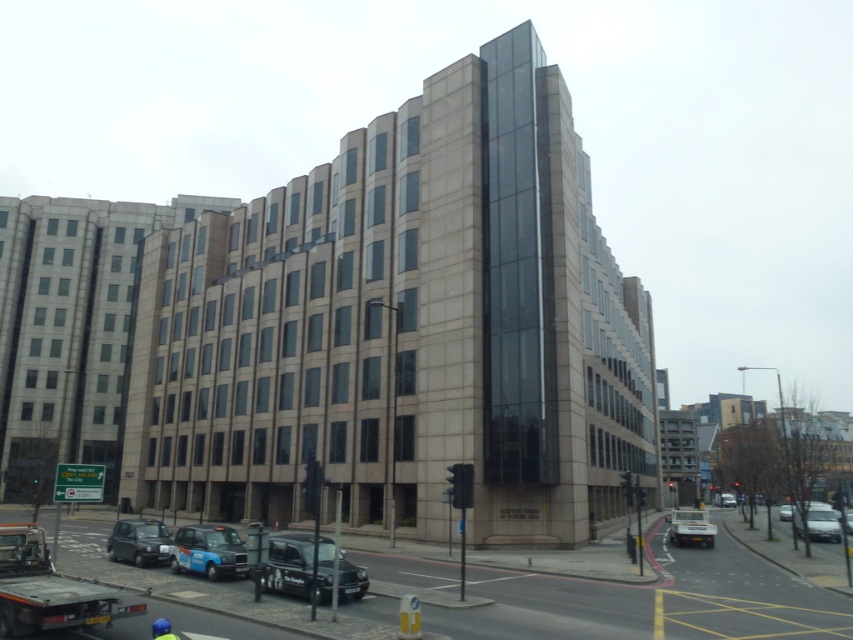
Question: Does blue metallic taxi at lower center have a larger size compared to metallic silver car at right?

Choices:
 (A) no
 (B) yes

Answer: (A)

Question: Is black matte taxi at lower center positioned in front of blue metallic taxi at lower center?

Choices:
 (A) no
 (B) yes

Answer: (B)

Question: Does metallic silver car at lower right appear under metallic silver car at right?

Choices:
 (A) no
 (B) yes

Answer: (A)

Question: Which object is closer to the camera taking this photo?

Choices:
 (A) matte black car at lower left
 (B) black matte taxi at lower center

Answer: (B)

Question: Which object is the closest to the matte black car at lower left?

Choices:
 (A) metallic silver car at lower right
 (B) black matte taxi at lower center
 (C) blue metallic taxi at lower center

Answer: (C)

Question: Which point is farther to the camera?

Choices:
 (A) (277, 586)
 (B) (231, 572)
 (C) (115, 524)
 (D) (787, 506)

Answer: (D)